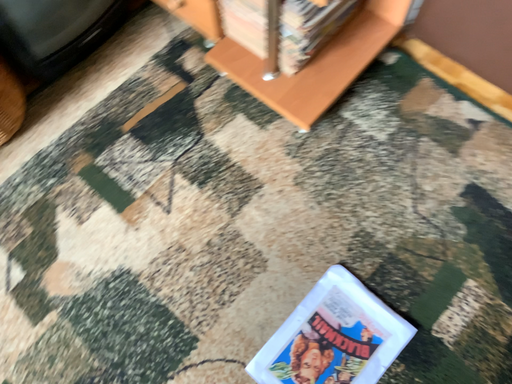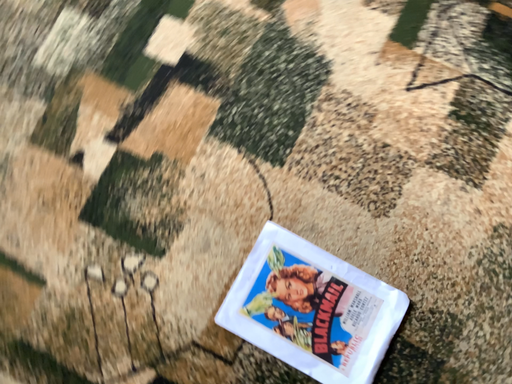
Question: How did the camera likely rotate when shooting the video?

Choices:
 (A) rotated left
 (B) rotated right

Answer: (A)